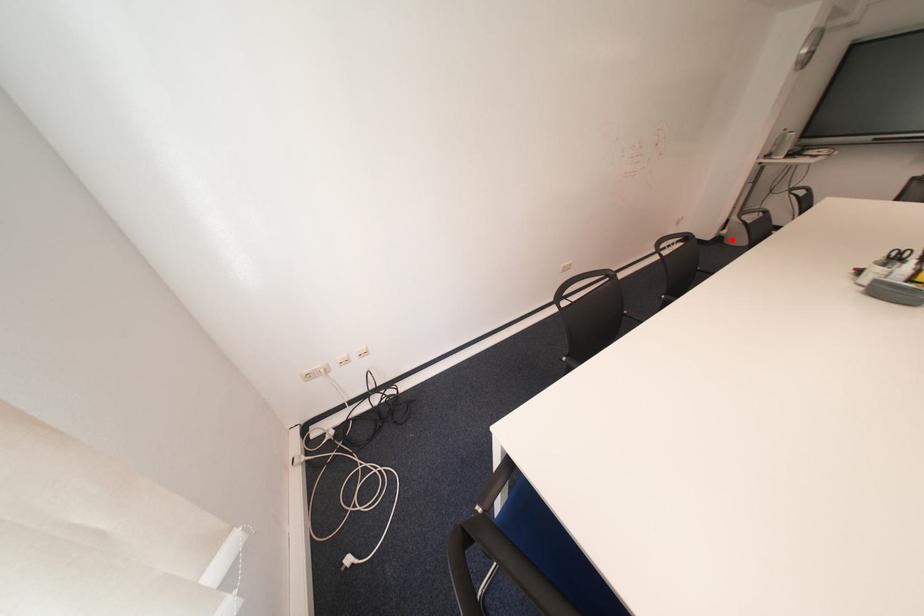
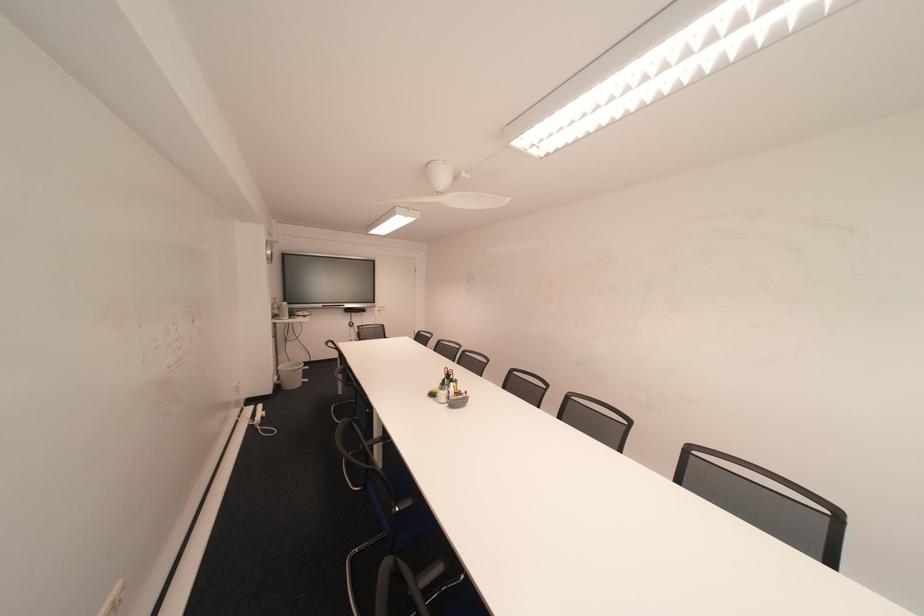
Question: A red point is marked in image1. In image2, is the corresponding 3D point closer to the camera or farther? Reply with the corresponding letter.

Choices:
 (A) The corresponding 3D point is closer.
 (B) The corresponding 3D point is farther.

Answer: (B)